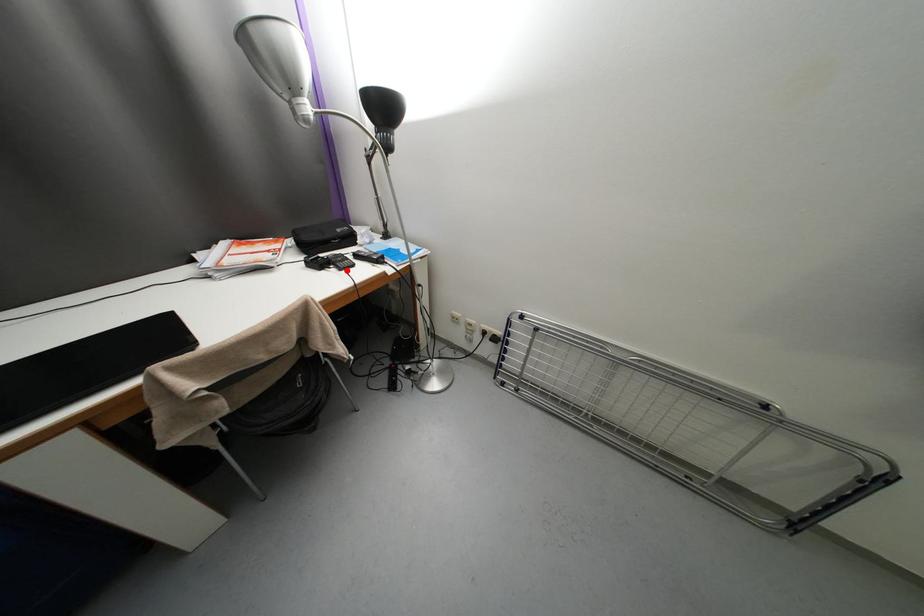
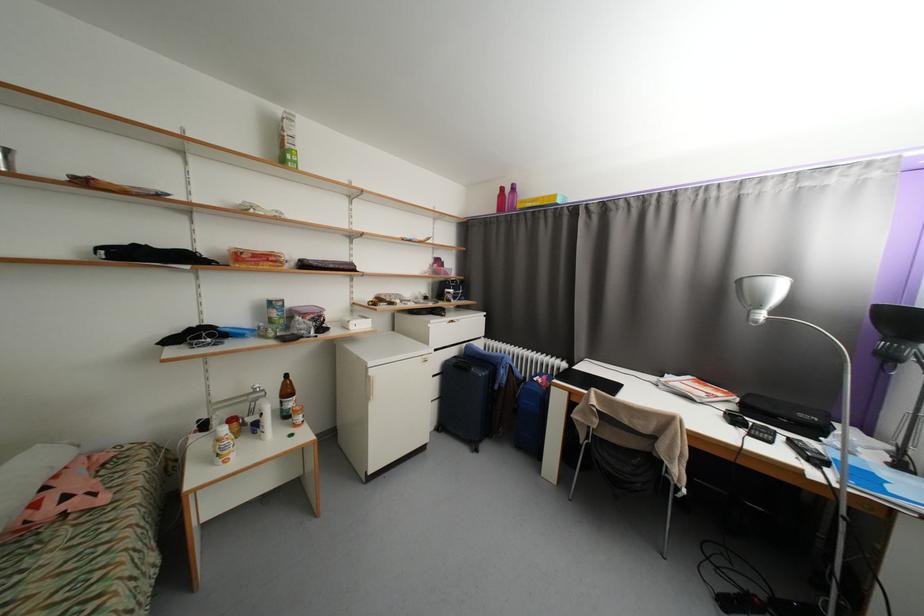
In the second image, find the point that corresponds to the highlighted location in the first image.

(757, 436)